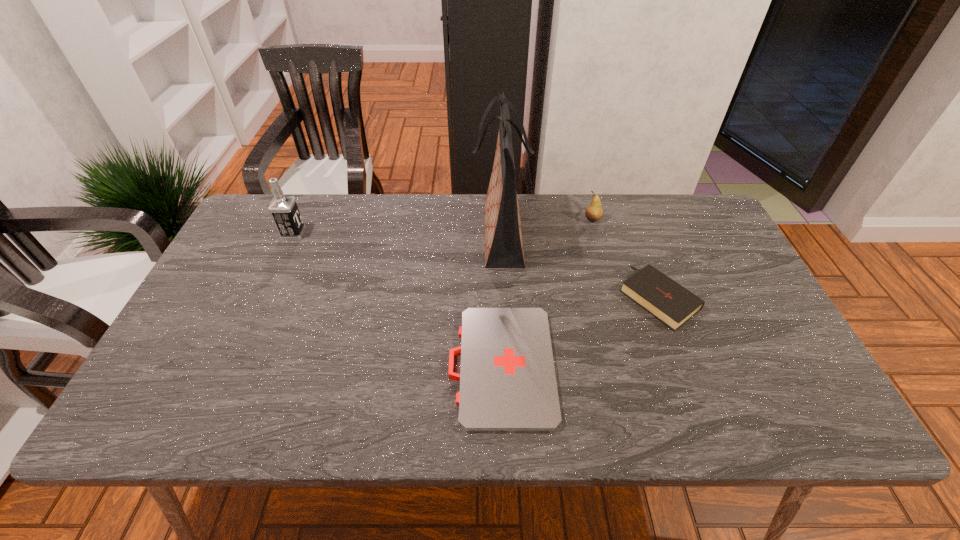
This screenshot has height=540, width=960. What are the coordinates of `shopping bag` in the screenshot? It's located at (503, 237).

I want to click on the leftmost object, so click(284, 210).

Locate an element on the screen. the fourth shortest object is located at coordinates (284, 210).

Identify the location of the third shortest object. The width and height of the screenshot is (960, 540). (x=594, y=212).

Find the location of `Bible`. Bible is located at coordinates (668, 301).

I want to click on the first-aid kit, so 507,378.

This screenshot has width=960, height=540. What are the coordinates of `vacant space situated on the front-facing side of the tallest object` in the screenshot? It's located at (342, 234).

Where is `vacant space located on the front-facing side of the tallest object`? The image size is (960, 540). vacant space located on the front-facing side of the tallest object is located at coordinates (401, 234).

What are the coordinates of `vacant position located 0.330m on the front-facing side of the tallest object` in the screenshot? It's located at (365, 234).

Find the location of `vacant space situated 0.350m on the front label of the vodka`. vacant space situated 0.350m on the front label of the vodka is located at coordinates (420, 234).